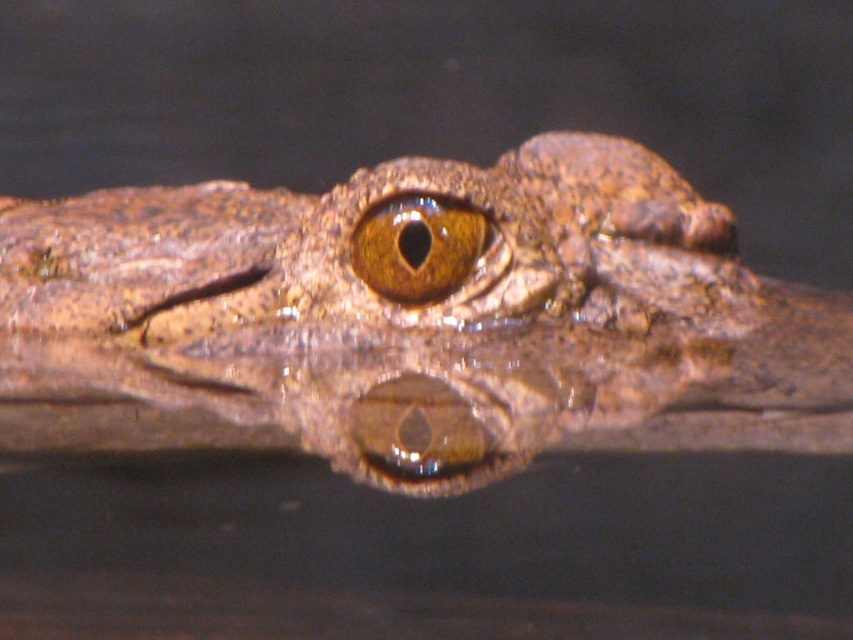
From the picture: Between brown scaly crocodile at center and brown matte eye at center, which one has more height?

brown scaly crocodile at center is taller.

Does brown scaly crocodile at center appear over brown matte eye at center?

No.

This screenshot has width=853, height=640. I want to click on brown scaly crocodile at center, so click(413, 321).

Where is `brown scaly crocodile at center`? Image resolution: width=853 pixels, height=640 pixels. brown scaly crocodile at center is located at coordinates (413, 321).